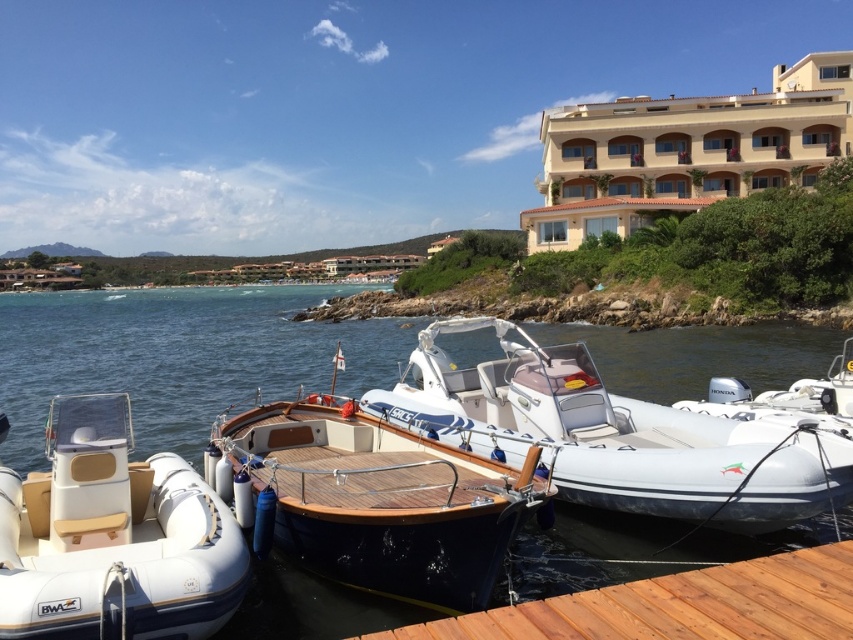
You are standing on the wooden pier and want to estimate how far the beige stucco building at upper right is from your current position. Based on the scene, what is the approximate distance?

The beige stucco building at upper right is approximately 47.42 meters away from the viewer, so the distance is about 47.42 meters.

You are planning to store both the white rubber boat at lower left and the white rubber boat at right in a storage room. The storage room has a width of 1.5 meters. Which boat will require more space in the storage room?

The white rubber boat at right requires more space in the storage room because it has a greater width than the white rubber boat at lower left.

You are a visitor at the marina and want to board the boat that is closer to the wooden pier. Which boat should you choose between the white rubber boat at lower left and the white rubber boat at right?

The white rubber boat at lower left is positioned on the left side of white rubber boat at right, so the white rubber boat at lower left is closer to the wooden pier. You should choose the white rubber boat at lower left.